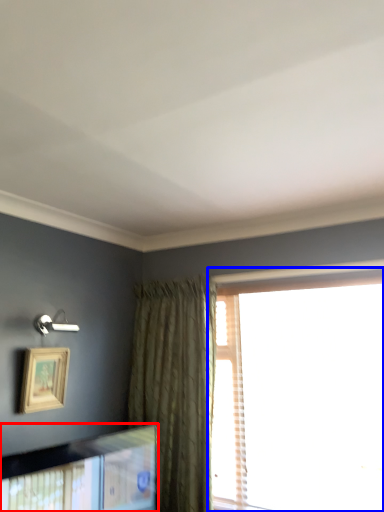
Question: Which point is further to the camera, picture frame (highlighted by a red box) or window (highlighted by a blue box)?

Choices:
 (A) picture frame
 (B) window

Answer: (B)